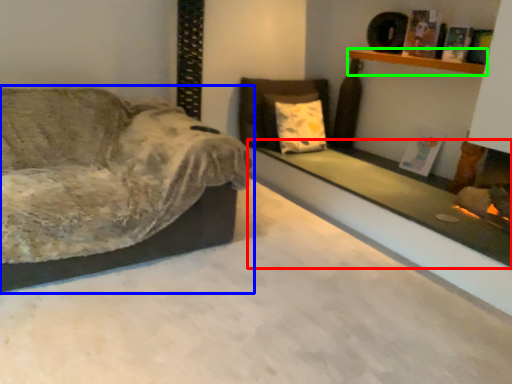
Question: Based on their relative distances, which object is farther from ledge (highlighted by a red box)? Choose from studio couch (highlighted by a blue box) and shelf (highlighted by a green box).

Choices:
 (A) studio couch
 (B) shelf

Answer: (A)